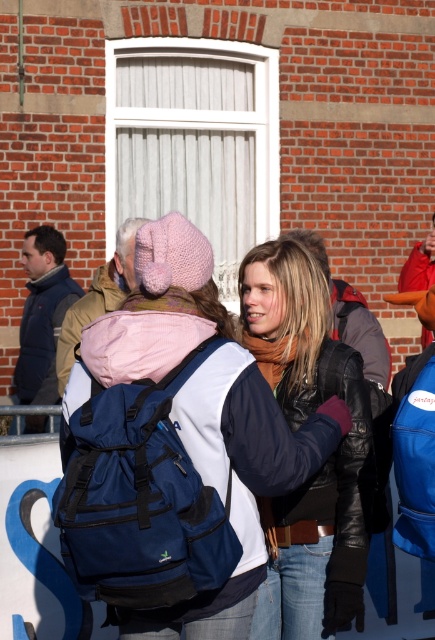
You are a photographer standing at the center of the scene. You want to take a photo of the matte black jacket at center. Where should you aim your camera to capture it?

You should aim your camera at point [327,458] to capture the matte black jacket at center.